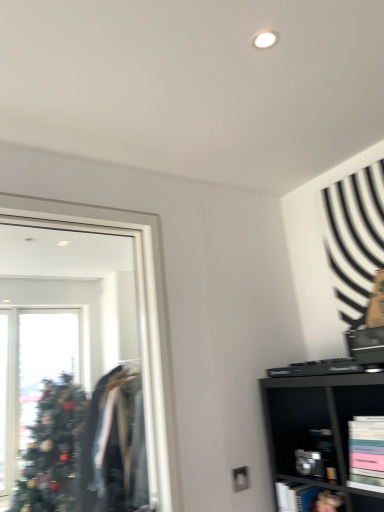
Question: Is metallic silver cabinet at lower right, the second cabinet from the front, in front of or behind matte black bookshelf at lower right, acting as the 2th cabinet starting from the back, in the image?

Choices:
 (A) front
 (B) behind

Answer: (B)

Question: Looking at the image, does metallic silver cabinet at lower right, arranged as the 2th cabinet when viewed from the top, seem bigger or smaller compared to matte black bookshelf at lower right, arranged as the 2th cabinet when ordered from the bottom?

Choices:
 (A) small
 (B) big

Answer: (A)

Question: Based on their relative distances, which object is nearer to the clear glass mirror at left?

Choices:
 (A) metallic silver cabinet at lower right, the second cabinet from the front
 (B) matte black bookshelf at lower right, acting as the 2th cabinet starting from the back

Answer: (A)

Question: Estimate the real-world distances between objects in this image. Which object is closer to the metallic silver cabinet at lower right, the 1th cabinet viewed from the back?

Choices:
 (A) matte black bookshelf at lower right, positioned as the first cabinet in front-to-back order
 (B) clear glass mirror at left

Answer: (A)